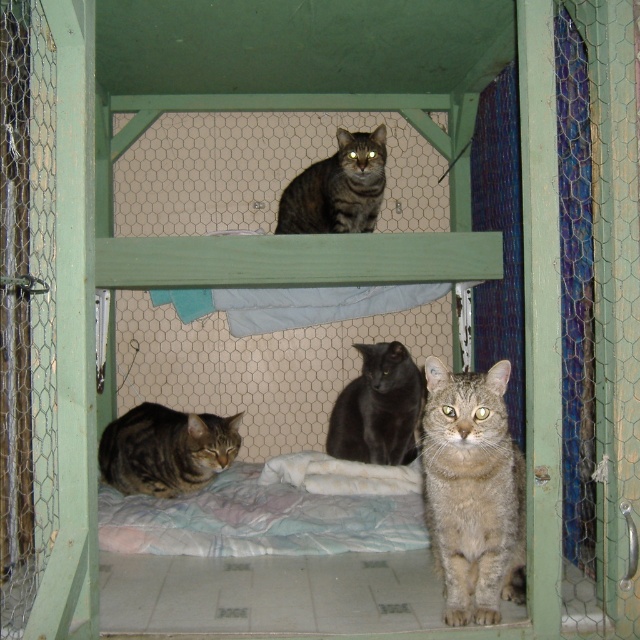
Can you confirm if black glossy cat at center is bigger than tabby fur cat at upper center?

No.

Can you confirm if black glossy cat at center is wider than tabby fur cat at upper center?

In fact, black glossy cat at center might be narrower than tabby fur cat at upper center.

Does point (358, 397) come behind point (314, 163)?

No, it is not.

Locate an element on the screen. The image size is (640, 640). black glossy cat at center is located at coordinates (378, 408).

Is tabby fur cat at center above tabby fur cat at lower left?

Yes.

Can you confirm if tabby fur cat at center is wider than tabby fur cat at lower left?

In fact, tabby fur cat at center might be narrower than tabby fur cat at lower left.

Is point (486, 604) less distant than point (163, 429)?

That is True.

The height and width of the screenshot is (640, 640). What are the coordinates of `tabby fur cat at center` in the screenshot? It's located at (472, 492).

Does tabby fur cat at center have a lesser height compared to black glossy cat at center?

No, tabby fur cat at center is not shorter than black glossy cat at center.

Can you confirm if tabby fur cat at center is smaller than black glossy cat at center?

Incorrect, tabby fur cat at center is not smaller in size than black glossy cat at center.

Image resolution: width=640 pixels, height=640 pixels. What do you see at coordinates (472, 492) in the screenshot?
I see `tabby fur cat at center` at bounding box center [472, 492].

Locate an element on the screen. tabby fur cat at center is located at coordinates pyautogui.click(x=472, y=492).